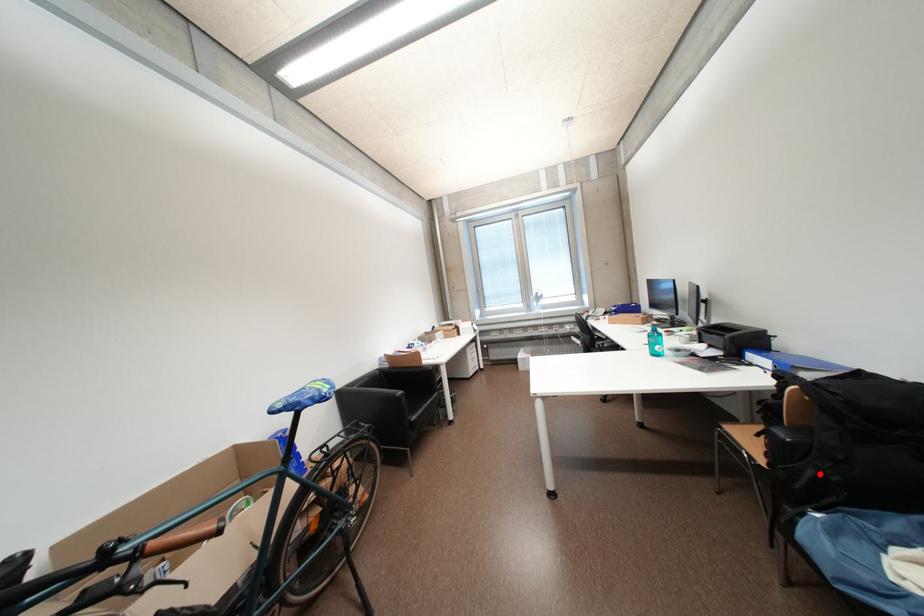
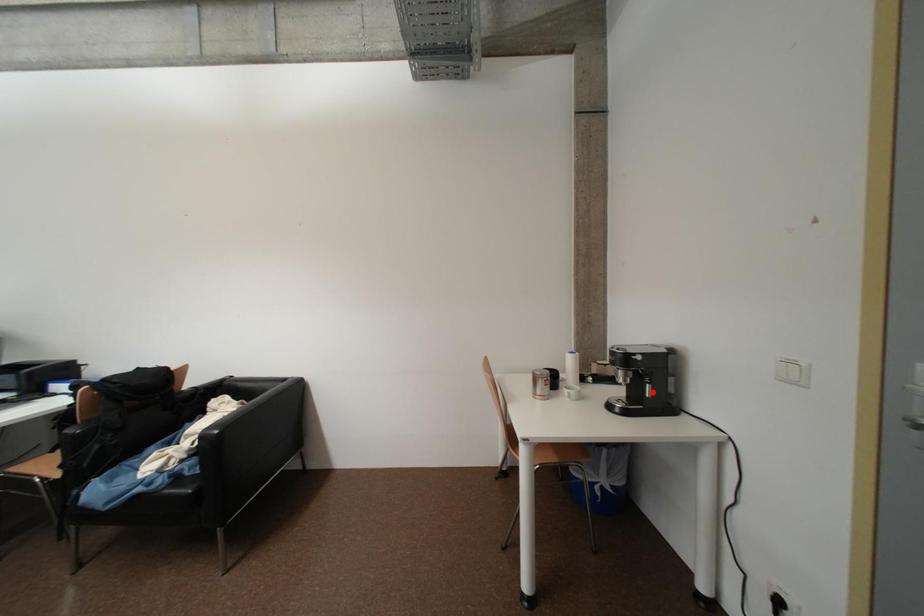
I am providing you with two images of the same scene from different viewpoints. A red point is marked on the first image and another point is marked on the second image. Is the red point in image1 aligned with the point shown in image2?

No